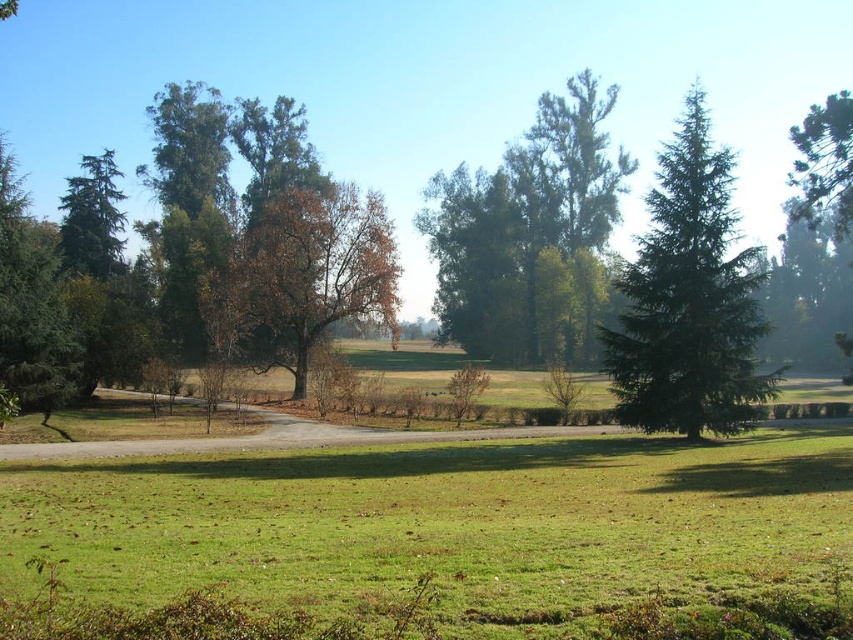
Question: Estimate the real-world distances between objects in this image. Which object is closer to the green grass at center?

Choices:
 (A) green leafy tree at center
 (B) green needle-like tree at left
 (C) green needle-like tree at right
 (D) brown leafy tree at center

Answer: (B)

Question: Which of these objects is positioned farthest from the green needle-like tree at right?

Choices:
 (A) green leafy tree at center
 (B) green needle-like tree at left

Answer: (B)

Question: Is green leafy tree at center wider than brown leafy tree at center?

Choices:
 (A) no
 (B) yes

Answer: (B)

Question: Which point is farther to the camera?

Choices:
 (A) (677, 563)
 (B) (341, 189)
 (C) (525, 232)
 (D) (726, 417)

Answer: (C)

Question: Is green needle-like tree at right smaller than green needle-like tree at left?

Choices:
 (A) no
 (B) yes

Answer: (B)

Question: Does green leafy tree at center lie in front of green needle-like tree at right?

Choices:
 (A) yes
 (B) no

Answer: (B)